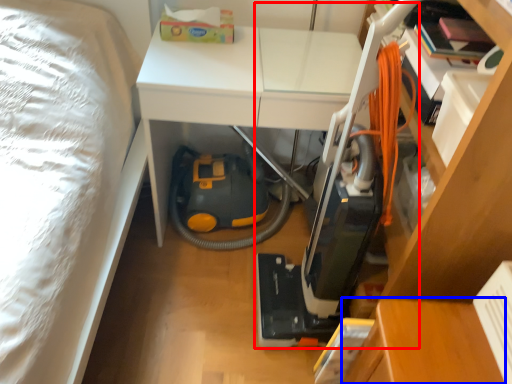
Question: Which object is further to the camera taking this photo, vacuum (highlighted by a red box) or table (highlighted by a blue box)?

Choices:
 (A) vacuum
 (B) table

Answer: (B)